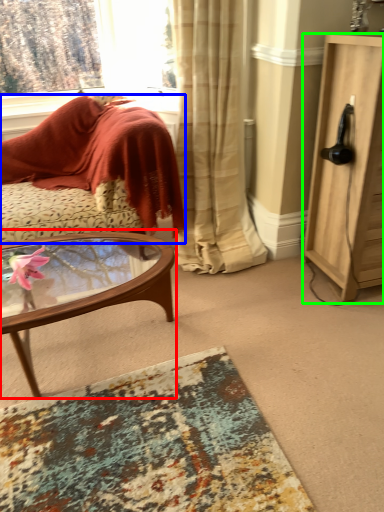
Question: Based on their relative distances, which object is nearer to coffee table (highlighted by a red box)? Choose from cushion (highlighted by a blue box) and cabinetry (highlighted by a green box).

Choices:
 (A) cushion
 (B) cabinetry

Answer: (A)